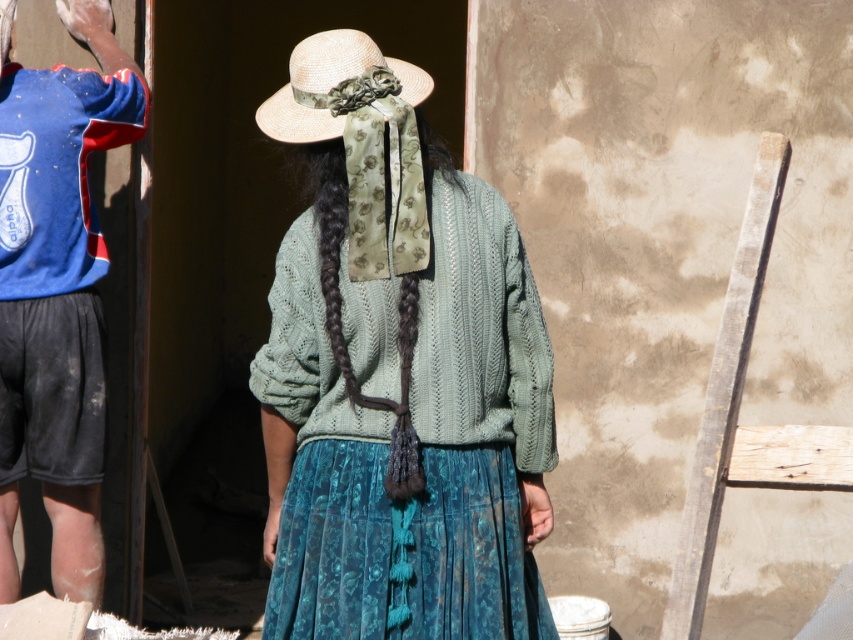
Can you confirm if straw hat at center is positioned below dark brown braided hair at center?

No.

Where is `straw hat at center`? This screenshot has width=853, height=640. straw hat at center is located at coordinates (335, 84).

Where is `wooden plank at right`? The width and height of the screenshot is (853, 640). wooden plank at right is located at coordinates (737, 413).

Between point (705, 477) and point (305, 88), which one is positioned in front?

Point (705, 477) is in front.

Locate an element on the screen. The width and height of the screenshot is (853, 640). wooden plank at right is located at coordinates (737, 413).

In the scene shown: Is blue fabric shirt at left positioned in front of straw hat at center?

No.

Consider the image. Is blue fabric shirt at left to the left of straw hat at center from the viewer's perspective?

Yes, blue fabric shirt at left is to the left of straw hat at center.

What do you see at coordinates (59, 243) in the screenshot?
I see `blue fabric shirt at left` at bounding box center [59, 243].

The width and height of the screenshot is (853, 640). In order to click on blue fabric shirt at left in this screenshot , I will do `click(59, 243)`.